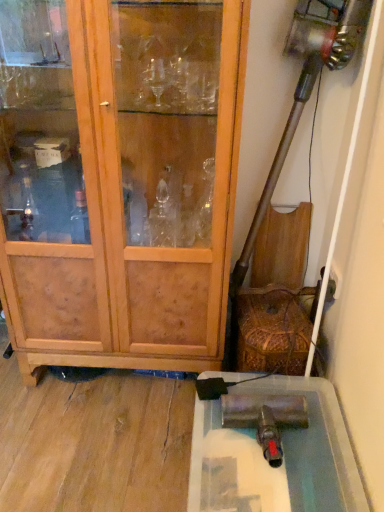
Where is `vacant area on top of metallic silver cabinet at lower right (from a real-world perspective)`? This screenshot has width=384, height=512. vacant area on top of metallic silver cabinet at lower right (from a real-world perspective) is located at coordinates (291, 440).